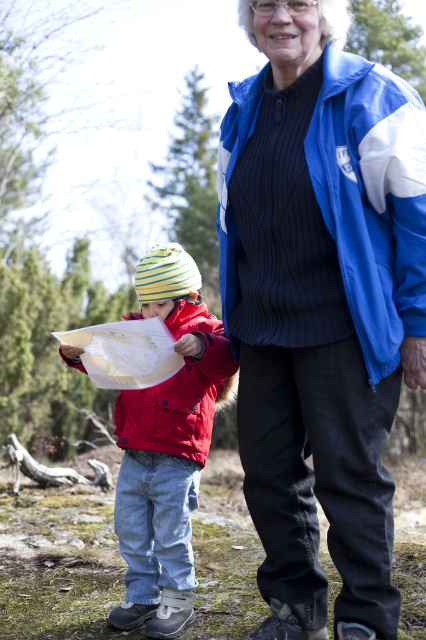
Question: Based on their relative distances, which object is farther from the blue fabric jacket at upper right?

Choices:
 (A) matte red jacket at lower left
 (B) matte red jacket at left

Answer: (B)

Question: Which object is positioned closest to the matte red jacket at left?

Choices:
 (A) blue fabric jacket at upper right
 (B) matte red jacket at lower left

Answer: (B)

Question: Which is farther from the matte red jacket at lower left?

Choices:
 (A) blue fabric jacket at upper right
 (B) matte red jacket at left

Answer: (A)

Question: Is blue fabric jacket at upper right further to camera compared to matte red jacket at left?

Choices:
 (A) no
 (B) yes

Answer: (A)

Question: Can you confirm if matte red jacket at left is positioned below matte red jacket at lower left?

Choices:
 (A) no
 (B) yes

Answer: (B)

Question: Does blue fabric jacket at upper right have a smaller size compared to matte red jacket at lower left?

Choices:
 (A) no
 (B) yes

Answer: (B)